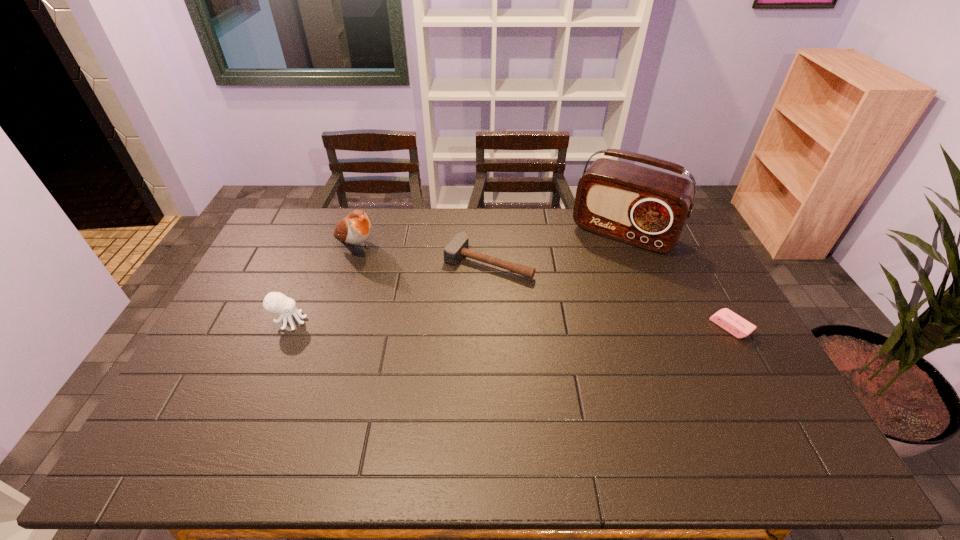
Identify the location of vacant region that satisfies the following two spatial constraints: 1. on the front side of the shortest object; 2. on the right side of the bird. (330, 327).